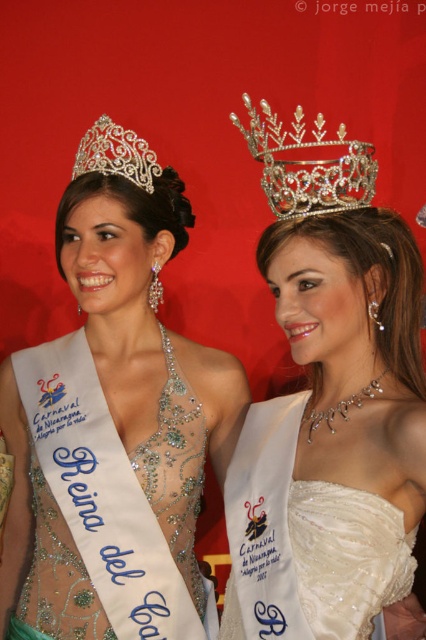
Based on the photo, which is below, matte silver tiara at upper center or ivory satin dress at center?

ivory satin dress at center is lower down.

The image size is (426, 640). What do you see at coordinates (114, 420) in the screenshot?
I see `matte silver tiara at upper center` at bounding box center [114, 420].

Where is `matte silver tiara at upper center`? This screenshot has height=640, width=426. matte silver tiara at upper center is located at coordinates (114, 420).

Is matte silver tiara at upper center to the right of clear crystal crown at upper center from the viewer's perspective?

No, matte silver tiara at upper center is not to the right of clear crystal crown at upper center.

Between point (43, 524) and point (316, 173), which one is positioned in front?

Point (316, 173) is in front.

What do you see at coordinates (114, 420) in the screenshot?
I see `matte silver tiara at upper center` at bounding box center [114, 420].

Find the location of `matte silver tiara at upper center`. matte silver tiara at upper center is located at coordinates coord(114,420).

Does ivory satin dress at center appear over clear crystal crown at upper center?

No, ivory satin dress at center is not above clear crystal crown at upper center.

Is ivory satin dress at center positioned in front of clear crystal crown at upper center?

Yes.

In order to click on ivory satin dress at center in this screenshot , I will do `click(331, 436)`.